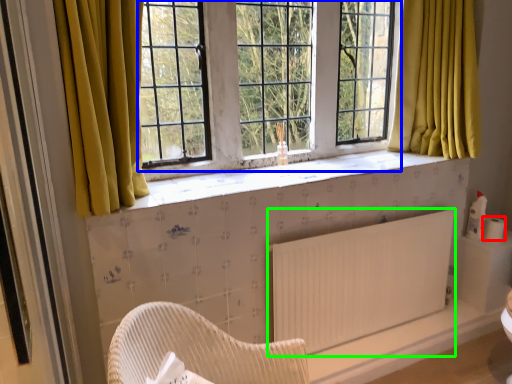
Question: Which object is positioned closest to toilet paper (highlighted by a red box)? Select from window screen (highlighted by a blue box) and radiator (highlighted by a green box).

Choices:
 (A) window screen
 (B) radiator

Answer: (B)